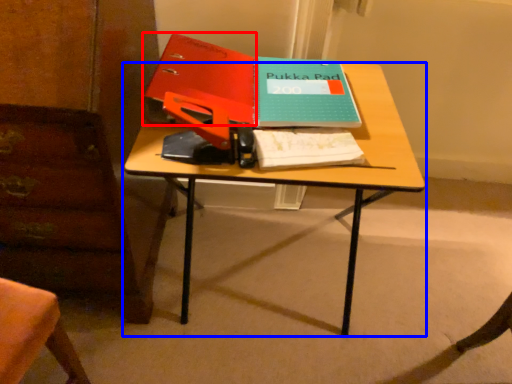
Question: Among these objects, which one is nearest to the camera, paperback book (highlighted by a red box) or desk (highlighted by a blue box)?

Choices:
 (A) paperback book
 (B) desk

Answer: (B)